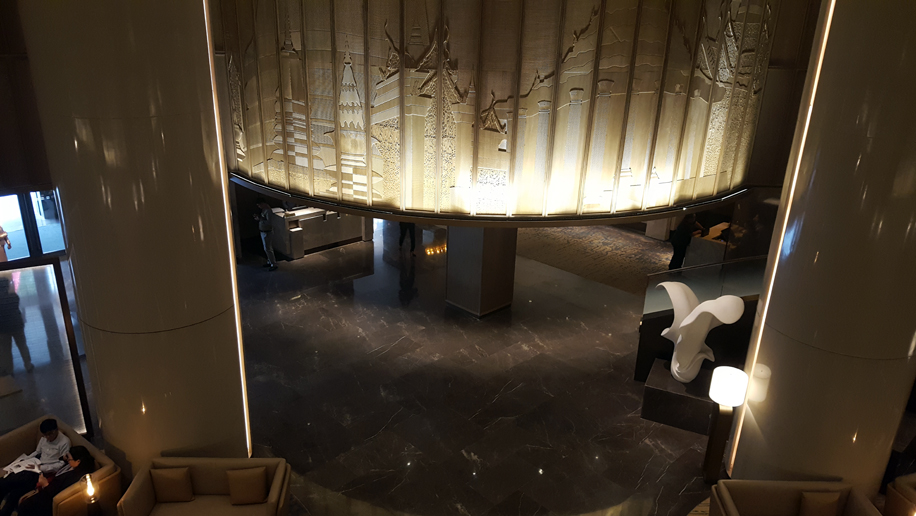
I want to click on door, so click(40, 350).